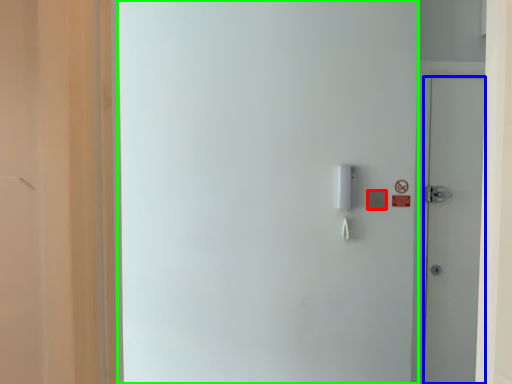
Question: Estimate the real-world distances between objects in this image. Which object is closer to light switch (highlighted by a red box), door (highlighted by a blue box) or screen door (highlighted by a green box)?

Choices:
 (A) door
 (B) screen door

Answer: (A)